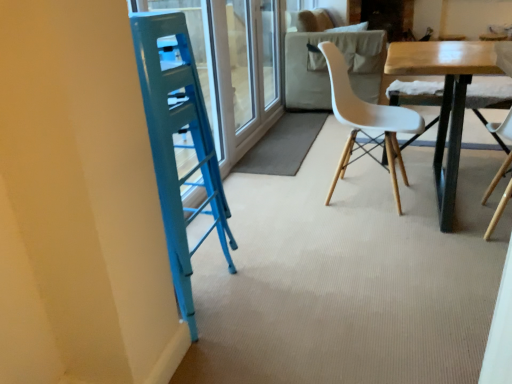
Question: From the image's perspective, is transparent glass screen door at upper center located above or below wooden table at center?

Choices:
 (A) below
 (B) above

Answer: (B)

Question: In terms of height, does transparent glass screen door at upper center look taller or shorter compared to wooden table at center?

Choices:
 (A) short
 (B) tall

Answer: (B)

Question: Which of these objects is positioned closest to the white matte plastic chair at center?

Choices:
 (A) wooden table at center
 (B) transparent glass screen door at upper center

Answer: (A)

Question: Considering the real-world distances, which object is closest to the transparent glass screen door at upper center?

Choices:
 (A) wooden table at center
 (B) white matte plastic chair at center

Answer: (B)